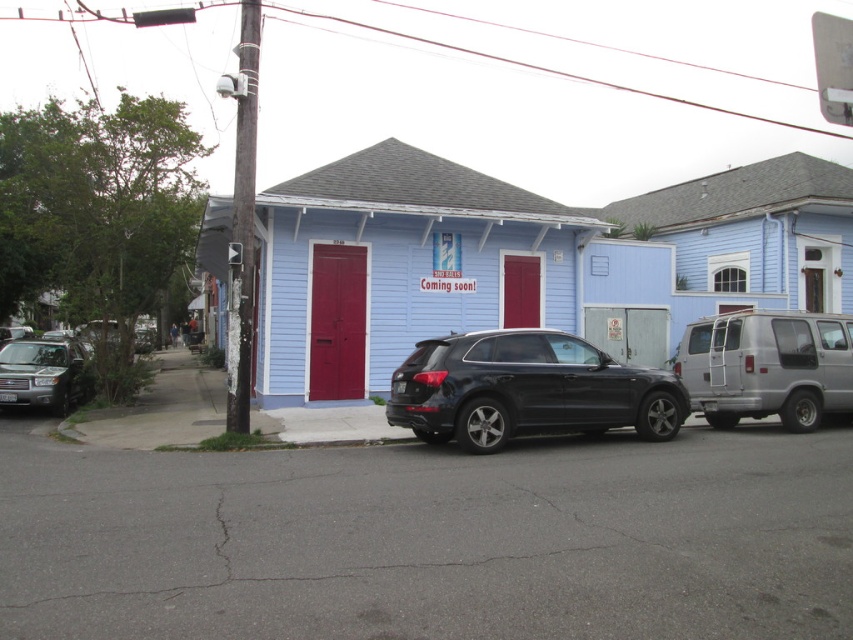
Question: Which point is farther to the camera?

Choices:
 (A) (814, 365)
 (B) (538, 358)

Answer: (A)

Question: Can you confirm if matte black suv at center is positioned to the right of silver metallic van at right?

Choices:
 (A) no
 (B) yes

Answer: (A)

Question: Among these points, which one is farthest from the camera?

Choices:
 (A) (786, 346)
 (B) (61, 342)

Answer: (B)

Question: Which of the following is the closest to the observer?

Choices:
 (A) silver metallic suv at left
 (B) matte black suv at center
 (C) silver metallic van at right

Answer: (B)

Question: Is silver metallic van at right bigger than silver metallic suv at left?

Choices:
 (A) no
 (B) yes

Answer: (A)

Question: Where is matte black suv at center located in relation to silver metallic suv at left in the image?

Choices:
 (A) below
 (B) above

Answer: (A)